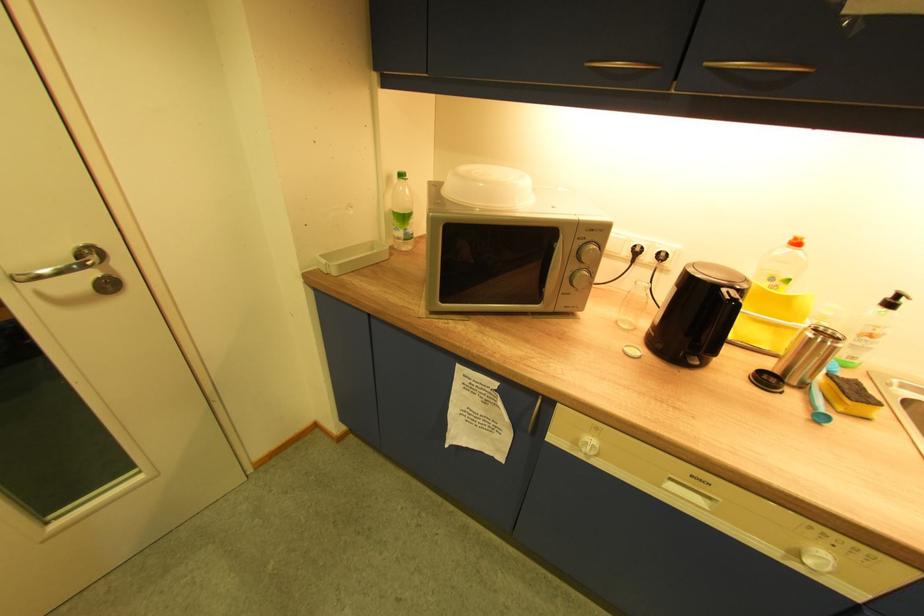
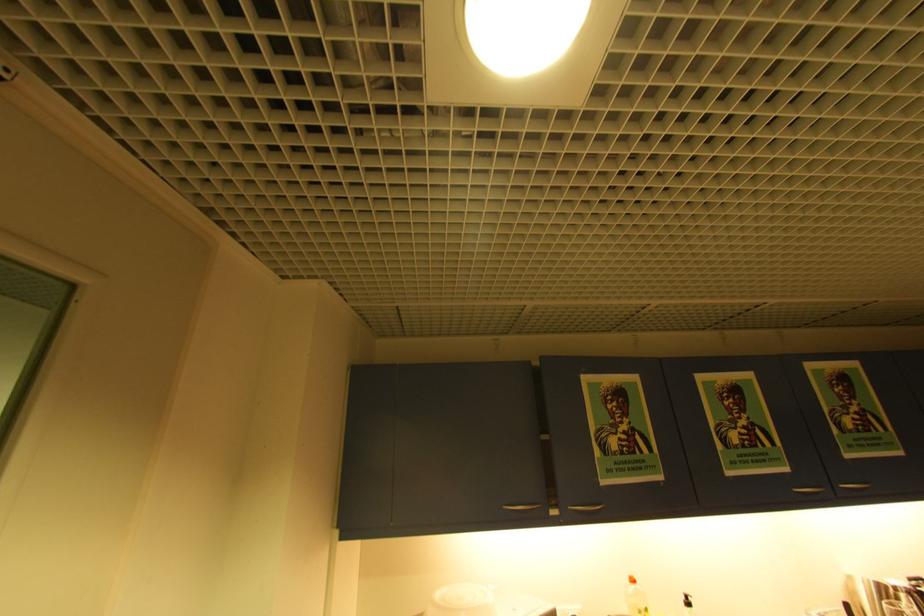
How did the camera likely rotate?

The camera rotated toward right-up.